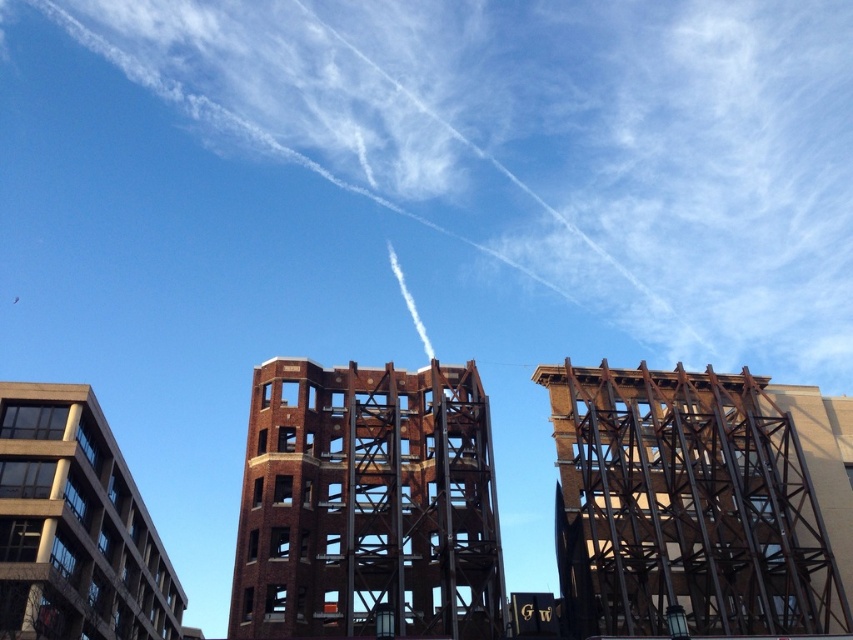
Question: Which object is closer to the camera taking this photo?

Choices:
 (A) brown brick tower at center
 (B) gray concrete building at left
 (C) rusty metal scaffolding at center

Answer: (A)

Question: Can you confirm if brown brick tower at center is positioned to the right of gray concrete building at left?

Choices:
 (A) yes
 (B) no

Answer: (A)

Question: Estimate the real-world distances between objects in this image. Which object is farther from the gray concrete building at left?

Choices:
 (A) brown brick tower at center
 (B) rusty metal scaffolding at center

Answer: (B)

Question: Is rusty metal scaffolding at center wider than gray concrete building at left?

Choices:
 (A) yes
 (B) no

Answer: (A)

Question: From the image, what is the correct spatial relationship of rusty metal scaffolding at center in relation to gray concrete building at left?

Choices:
 (A) below
 (B) above

Answer: (B)

Question: Which object is the farthest from the gray concrete building at left?

Choices:
 (A) brown brick tower at center
 (B) rusty metal scaffolding at center

Answer: (B)